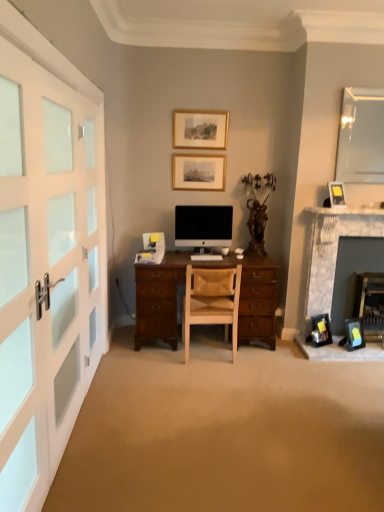
The image size is (384, 512). I want to click on free space above gold-framed picture at upper center, which is counted as the first picture frame, starting from the top (from a real-world perspective), so click(208, 106).